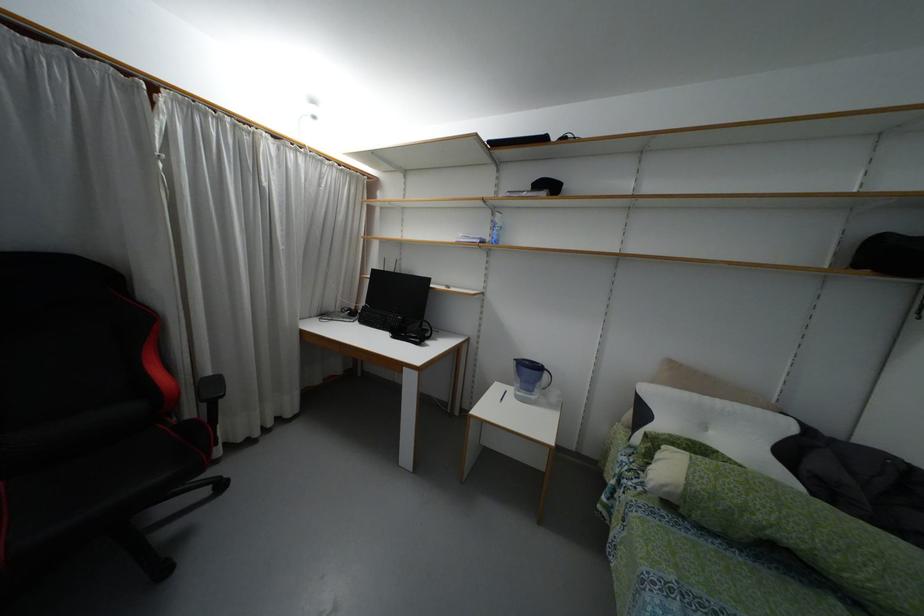
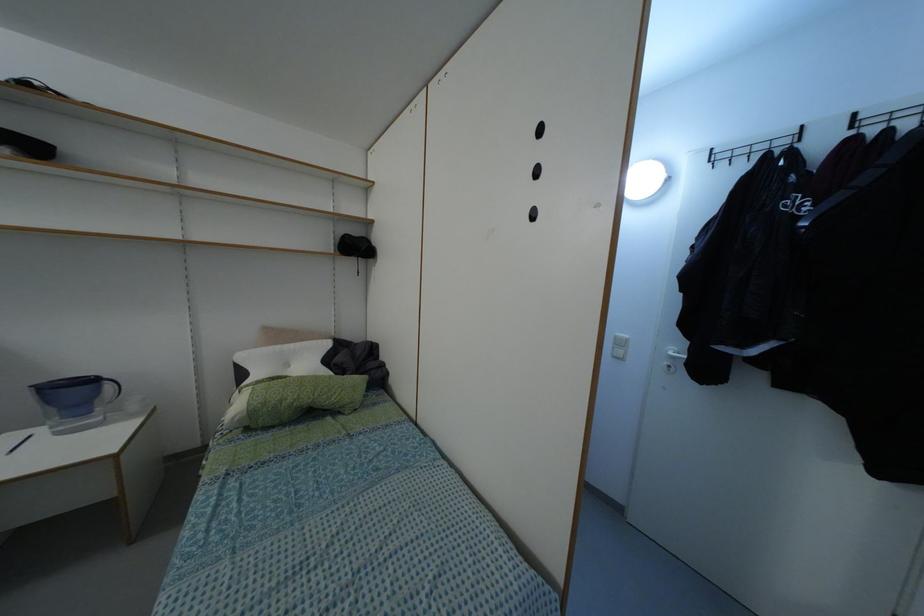
Question: The images are taken continuously from a first-person perspective. In which direction is your viewpoint rotating?

Choices:
 (A) Left
 (B) Right
 (C) Up
 (D) Down

Answer: (B)